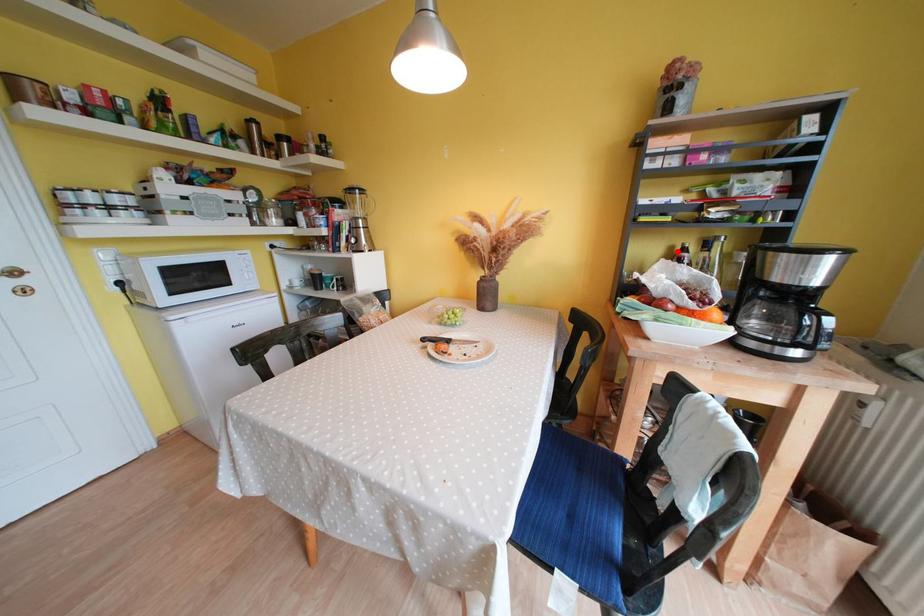
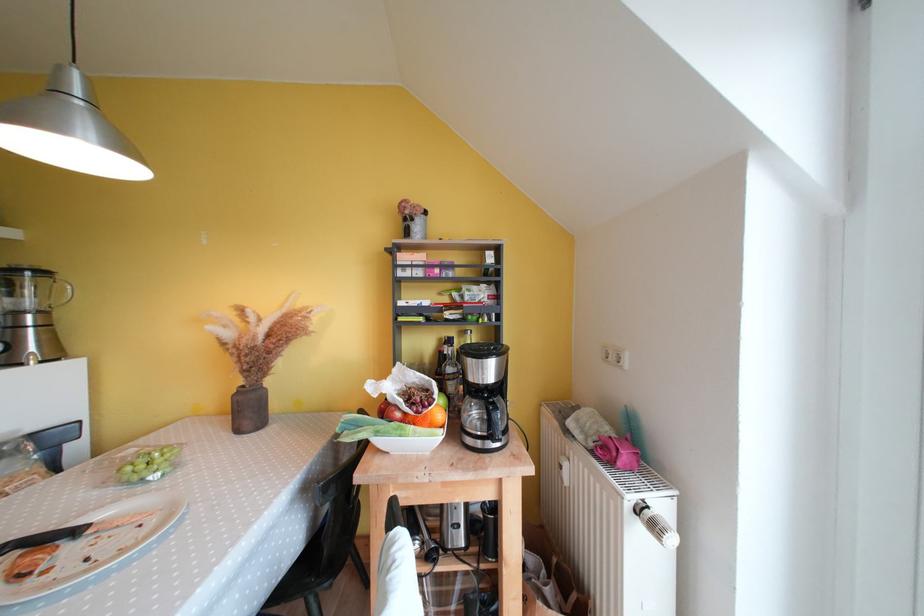
Find the pixel in the second image that matches the highlighted location in the first image.

(446, 342)